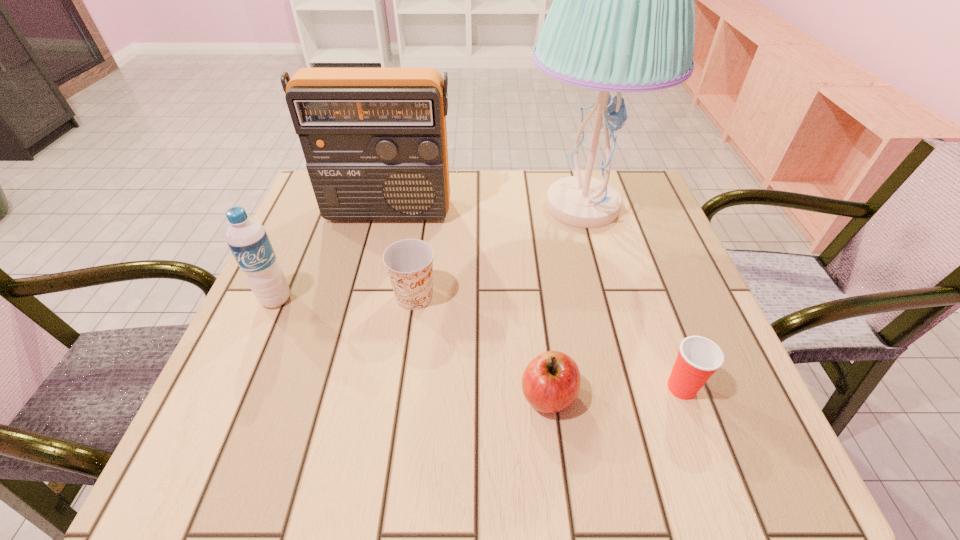
Locate an element on the screen. Image resolution: width=960 pixels, height=540 pixels. lamp is located at coordinates (622, 19).

Where is `the second tallest object`? The width and height of the screenshot is (960, 540). the second tallest object is located at coordinates (374, 139).

I want to click on the third tallest object, so click(247, 239).

The image size is (960, 540). In order to click on the farther Dixie cup in this screenshot , I will do `click(409, 262)`.

Where is `the right Dixie cup`? The image size is (960, 540). the right Dixie cup is located at coordinates (698, 358).

This screenshot has width=960, height=540. Identify the location of apple. (551, 382).

In order to click on free point located 0.240m on the front of the lamp in this screenshot , I will do `click(616, 328)`.

This screenshot has height=540, width=960. What are the coordinates of `free space located on the front-facing side of the fifth shortest object` in the screenshot? It's located at (376, 256).

Find the location of a particular element. This screenshot has height=540, width=960. vacant space located on the label of the water bottle is located at coordinates (218, 431).

Where is `blank space located on the right of the farther Dixie cup`? The image size is (960, 540). blank space located on the right of the farther Dixie cup is located at coordinates (574, 296).